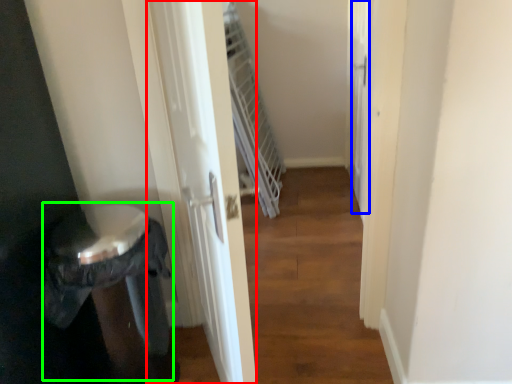
Question: Considering the real-world distances, which object is closest to screen door (highlighted by a red box)? screen door (highlighted by a blue box) or potty (highlighted by a green box).

Choices:
 (A) screen door
 (B) potty

Answer: (B)